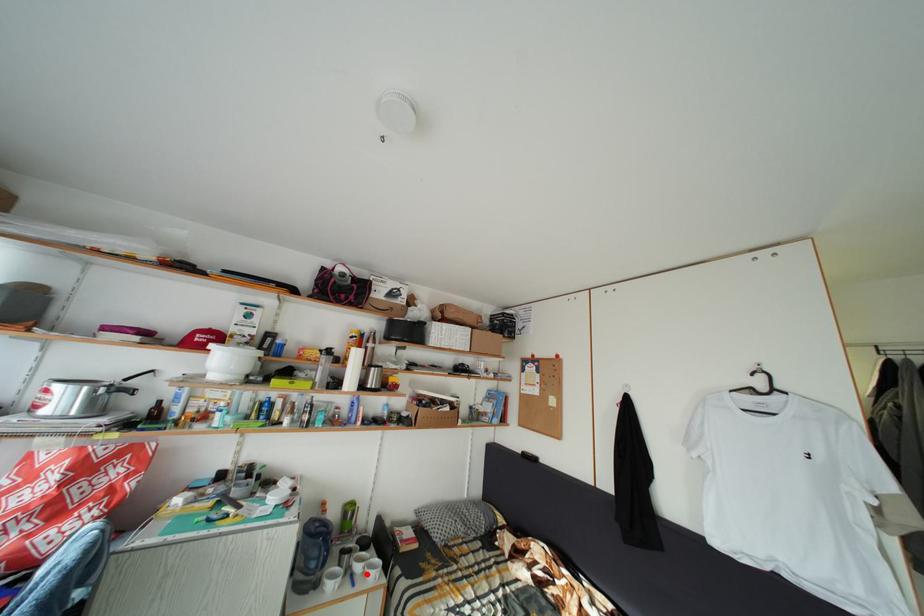
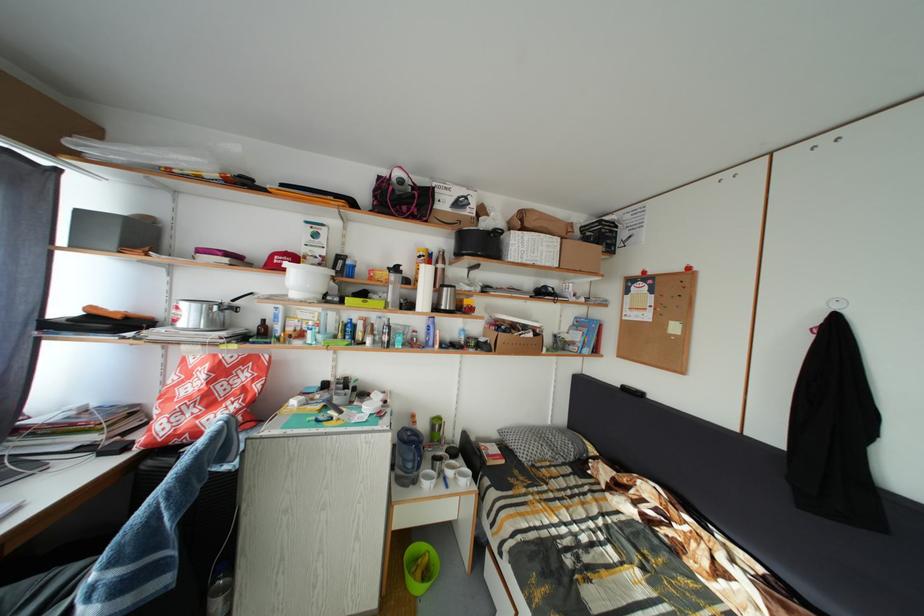
In the second image, find the point that corresponds to the highlighted location in the first image.

(458, 480)